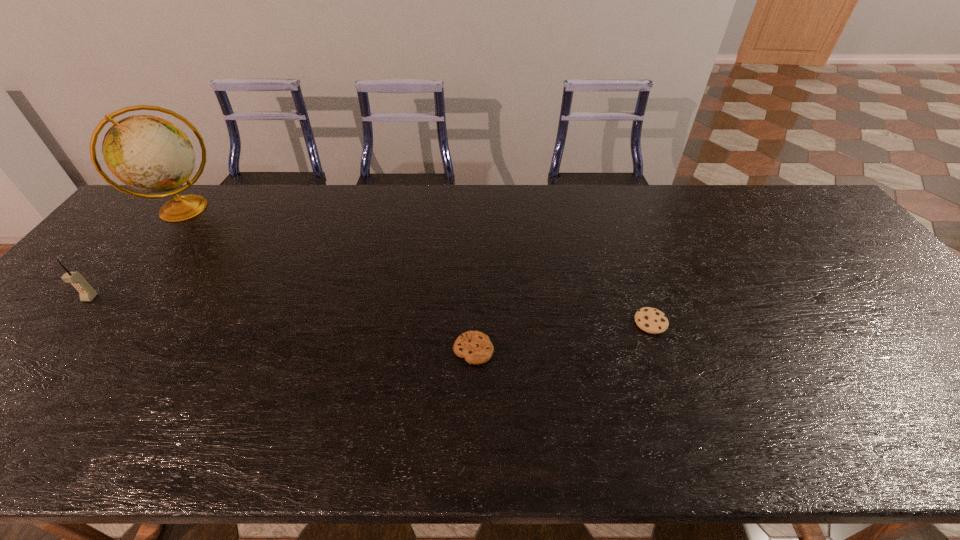
Where is `free space between the second tallest object and the second object from right to left`? Image resolution: width=960 pixels, height=540 pixels. free space between the second tallest object and the second object from right to left is located at coordinates (281, 324).

Locate an element on the screen. free area in between the second farthest object and the left cookie is located at coordinates (281, 324).

The image size is (960, 540). What are the coordinates of `free space between the second tallest object and the left cookie` in the screenshot? It's located at (281, 324).

I want to click on free space between the rightmost object and the third nearest object, so click(371, 310).

The width and height of the screenshot is (960, 540). What are the coordinates of `vacant space in between the right cookie and the cellular telephone` in the screenshot? It's located at (371, 310).

This screenshot has width=960, height=540. Find the location of `free point between the second tallest object and the right cookie`. free point between the second tallest object and the right cookie is located at coordinates (371, 310).

You are a GUI agent. You are given a task and a screenshot of the screen. Output one action in this format:
    pyautogui.click(x=<x>, y=<y>)
    Task: Click on the empty space between the rightmost object and the second tallest object
    The width and height of the screenshot is (960, 540).
    Given the screenshot: What is the action you would take?
    pyautogui.click(x=371, y=310)

Image resolution: width=960 pixels, height=540 pixels. Identify the location of unoccupied position between the cellular telephone and the tallest object. (136, 253).

The width and height of the screenshot is (960, 540). I want to click on the closest object to the second tallest object, so click(150, 154).

Image resolution: width=960 pixels, height=540 pixels. I want to click on the third closest object to the right cookie, so click(x=86, y=292).